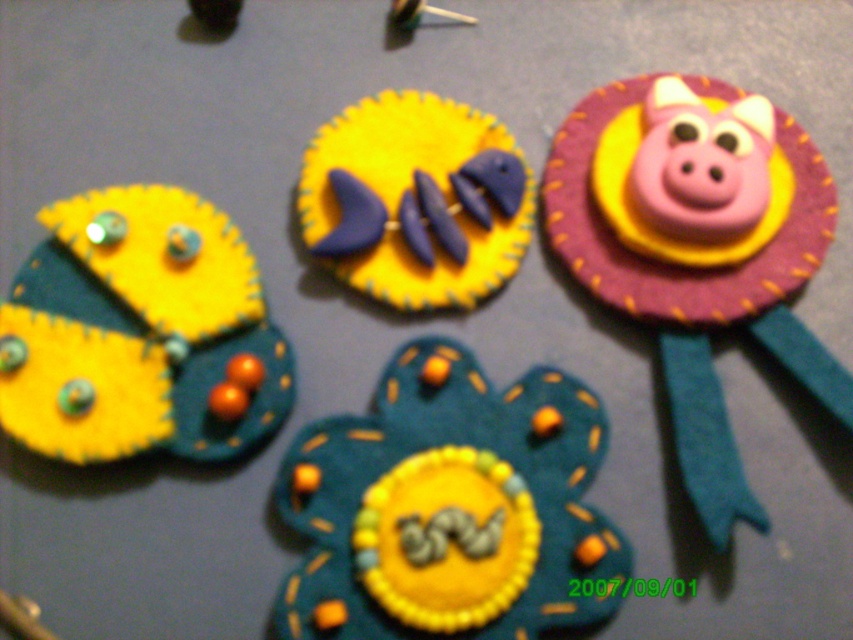
You are looking at the arrangement of decorative items on the flat surface. Where is the teal felt flower at center located in terms of its 2D coordinates?

The teal felt flower at center is located at the 2D coordinates point (450, 508).

You are organizing a craft fair and need to arrange items on a shelf. You have a teal felt flower at center and a pink felt ribbon at upper right. Which item should you place lower on the shelf to ensure stability?

The teal felt flower at center is shorter than the pink felt ribbon at upper right, so you should place the teal felt flower at center lower on the shelf to ensure stability.

You are arranging these decorative items on a shelf. If you want to place a new item between the yellow felt butterfly at left and the yellow felt fish at center, where should you position it?

The yellow felt butterfly at left is to the left of the yellow felt fish at center, so placing the new item between them would require positioning it to the right of the yellow felt butterfly at left and to the left of the yellow felt fish at center.